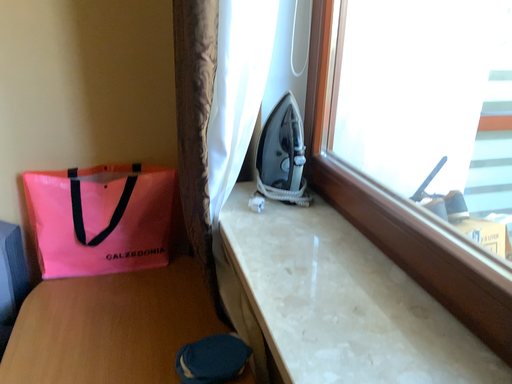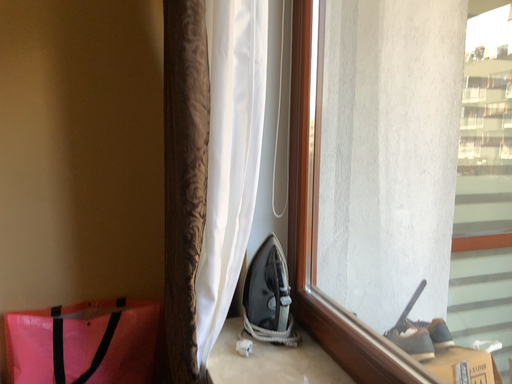
Question: Which way did the camera rotate in the video?

Choices:
 (A) rotated downward
 (B) rotated upward

Answer: (B)